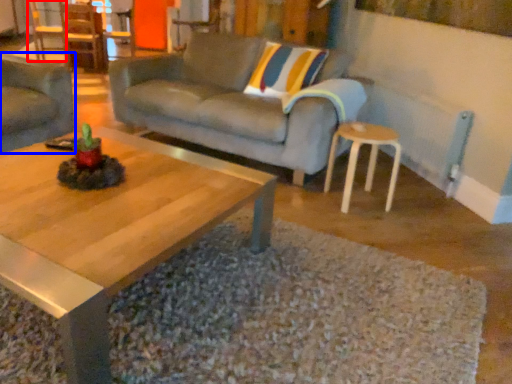
Question: Which object appears farthest to the camera in this image, chair (highlighted by a red box) or studio couch (highlighted by a blue box)?

Choices:
 (A) chair
 (B) studio couch

Answer: (A)